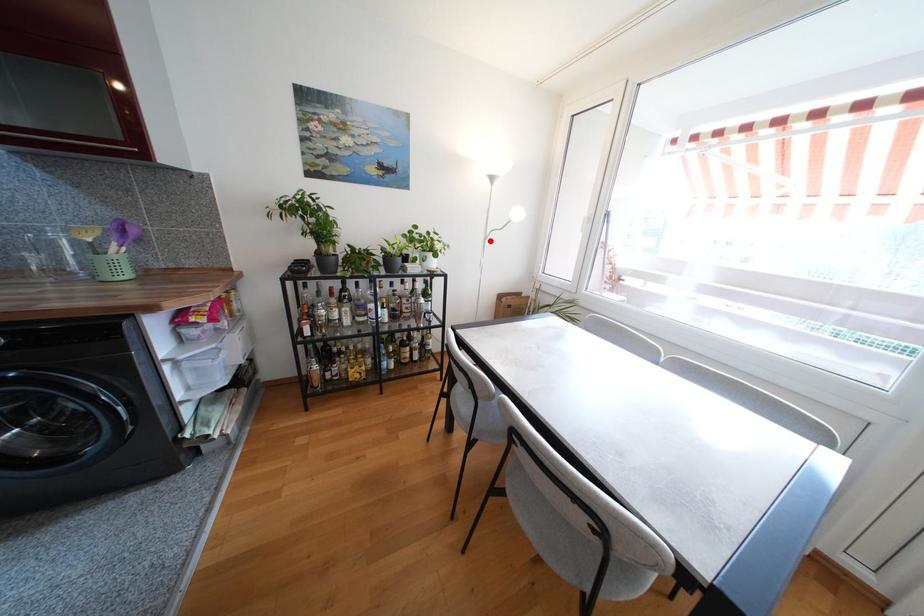
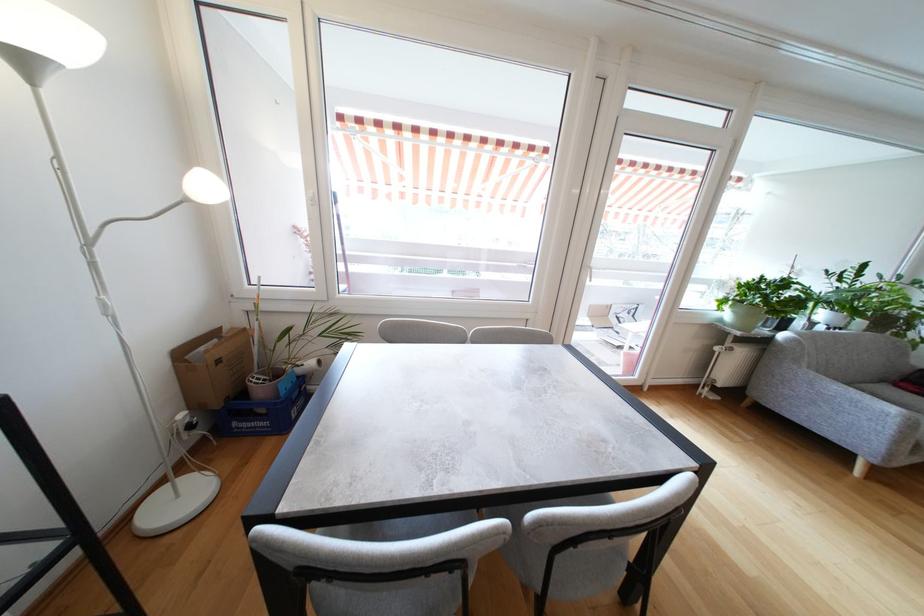
Question: I am providing you with two images of the same scene from different viewpoints. A red point is shown in image1. For the corresponding object point in image2, is it positioned nearer or farther from the camera?

Choices:
 (A) Nearer
 (B) Farther

Answer: (B)